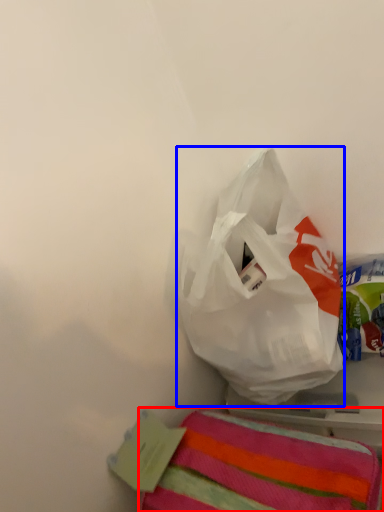
Question: Which point is closer to the camera, towel (highlighted by a red box) or plastic bag (highlighted by a blue box)?

Choices:
 (A) towel
 (B) plastic bag

Answer: (A)